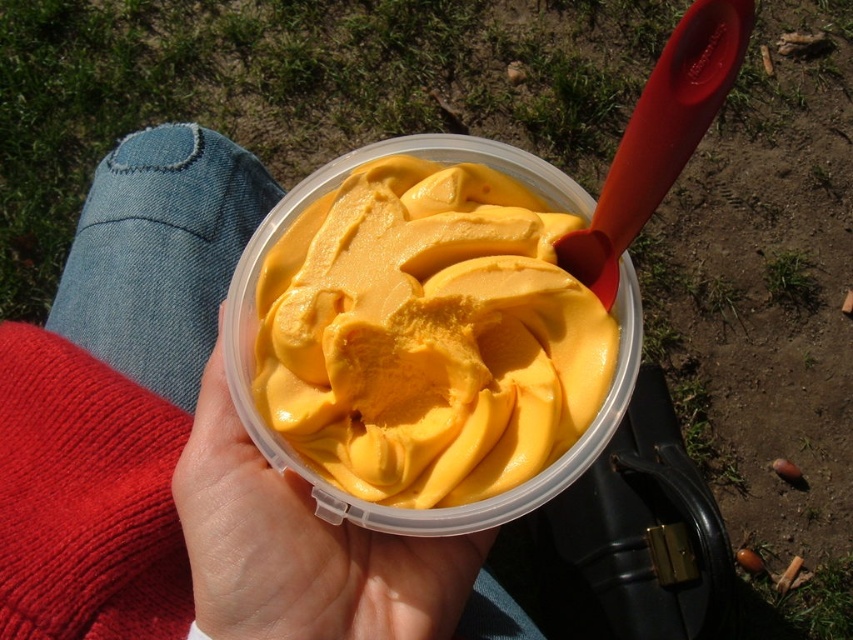
Question: Considering the relative positions of yellow creamy ice cream at center and yellow matte ice cream at center in the image provided, where is yellow creamy ice cream at center located with respect to yellow matte ice cream at center?

Choices:
 (A) left
 (B) right

Answer: (B)

Question: From the image, what is the correct spatial relationship of yellow creamy ice cream at center in relation to yellow matte ice cream at center?

Choices:
 (A) above
 (B) below

Answer: (A)

Question: Is yellow creamy ice cream at center thinner than yellow matte ice cream at center?

Choices:
 (A) yes
 (B) no

Answer: (B)

Question: Which point is farther to the camera?

Choices:
 (A) click(x=283, y=404)
 (B) click(x=453, y=627)

Answer: (B)